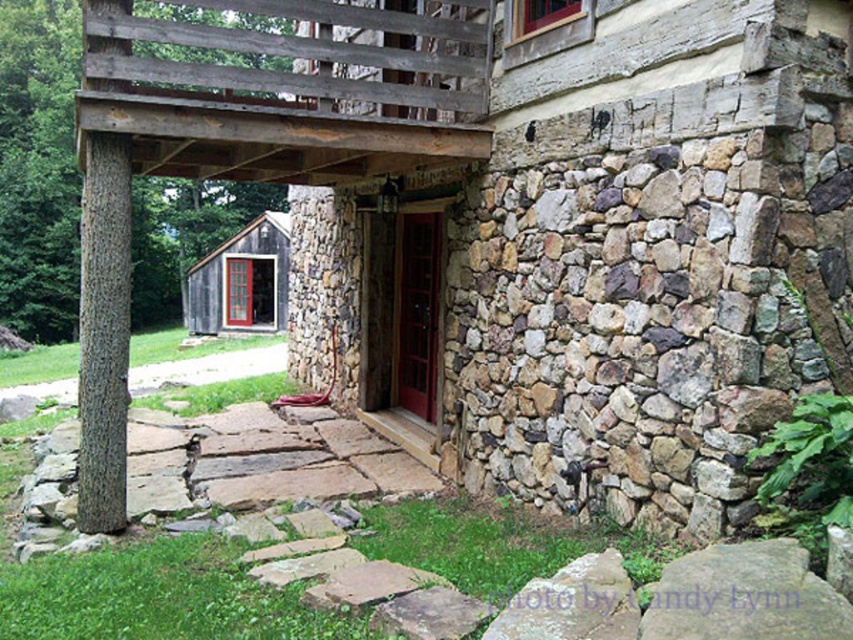
Question: Does brown rough bark tree at left appear on the right side of wooden cabin at lower left?

Choices:
 (A) yes
 (B) no

Answer: (B)

Question: Which of the following is the closest to the observer?

Choices:
 (A) (65, 294)
 (B) (218, 300)

Answer: (B)

Question: Is brown rough bark tree at left behind wooden cabin at lower left?

Choices:
 (A) yes
 (B) no

Answer: (B)

Question: Which point is closer to the camera?

Choices:
 (A) (74, 42)
 (B) (231, 248)

Answer: (B)

Question: Is brown rough bark tree at left positioned at the back of wooden cabin at lower left?

Choices:
 (A) yes
 (B) no

Answer: (B)

Question: Which object appears closest to the camera in this image?

Choices:
 (A) brown rough bark tree at left
 (B) wooden cabin at lower left

Answer: (A)